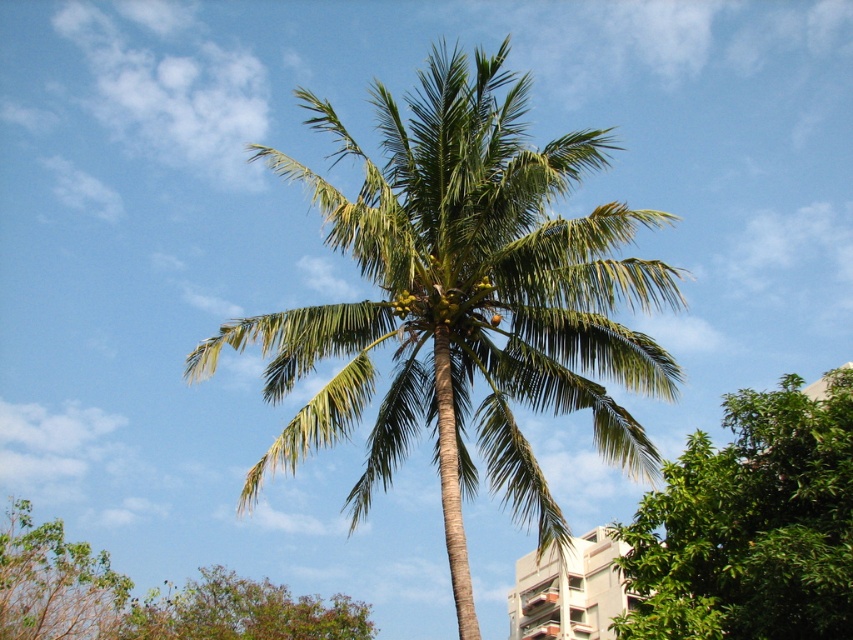
You are a landscape architect planning to install a new walkway between the green leafy palm tree at center and the brown leafy tree at lower left. The walkway needs to be 40 meters long to accommodate all visitors. Based on the scene, will the walkway fit between them?

The distance between the green leafy palm tree at center and the brown leafy tree at lower left is 41.01 meters. Since the required walkway is 40 meters long, it will fit comfortably between them with 1.01 meters of extra space.

You are standing at the base of the coconut palm tree in the center of the image. You notice two points marked in the scene. The first point is at coordinates point (366, 168), and the second is at point (668, 564). Which point is closer to you?

Point (668, 564) is closer to you because the other point is behind it according to the description.

You are standing in a garden and see two trees. There is a green leafy palm tree at center and a green leafy tree at center. Which one is positioned to the left?

The green leafy palm tree at center is positioned to the left of the green leafy tree at center.